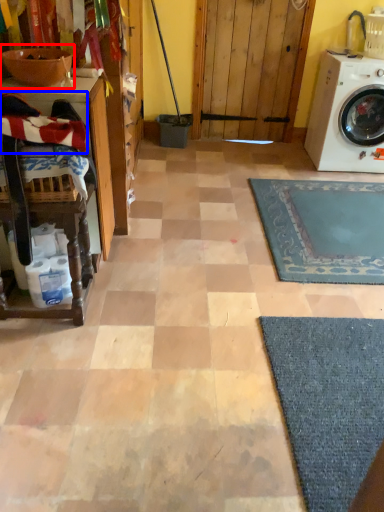
Question: Which object is closer to the camera taking this photo, sink (highlighted by a red box) or laundry (highlighted by a blue box)?

Choices:
 (A) sink
 (B) laundry

Answer: (B)